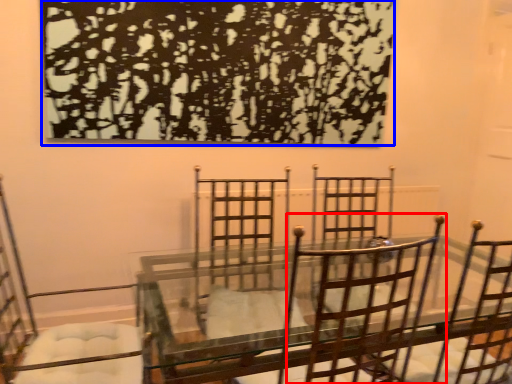
Question: Which of the following is the farthest to the observer, chair (highlighted by a red box) or tree (highlighted by a blue box)?

Choices:
 (A) chair
 (B) tree

Answer: (B)